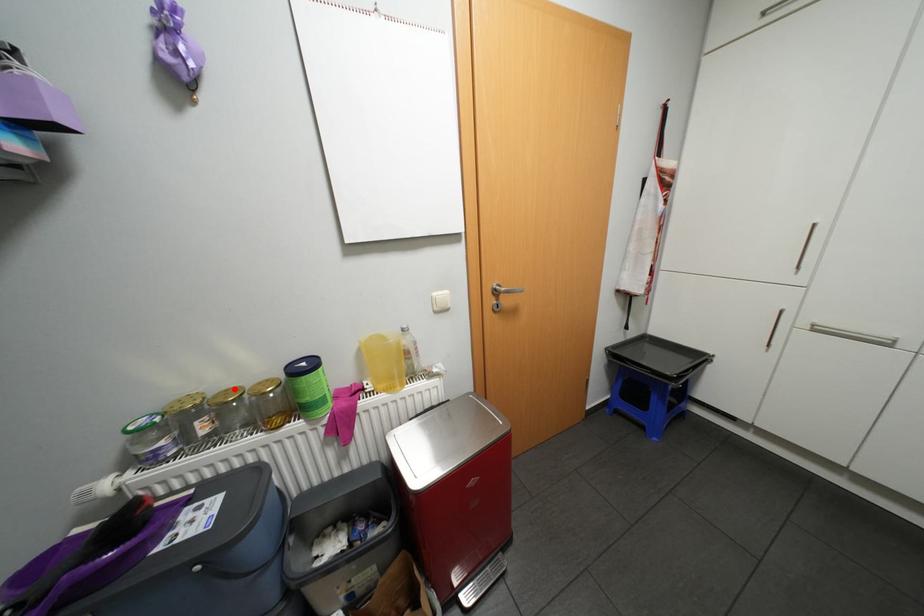
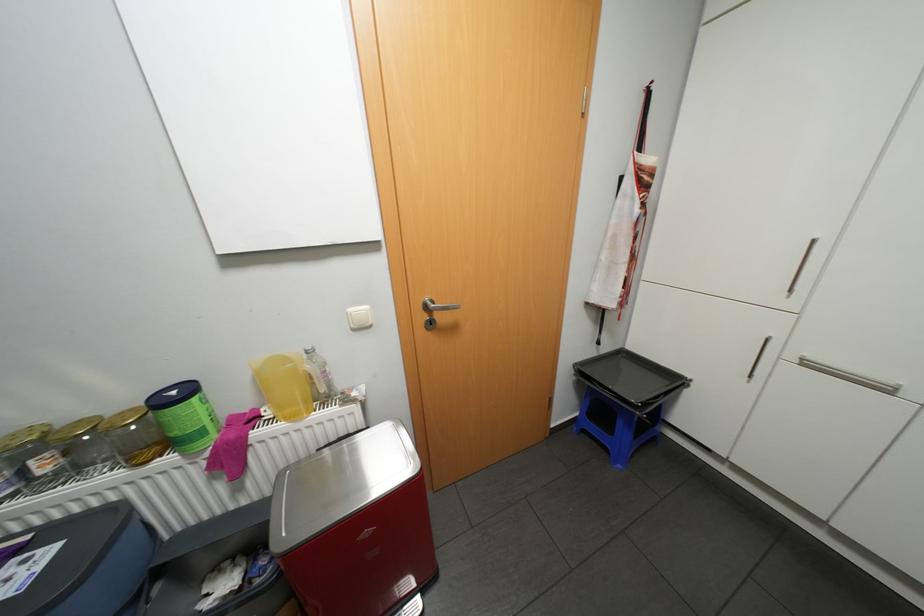
Find the pixel in the second image that matches the highlighted location in the first image.

(88, 419)